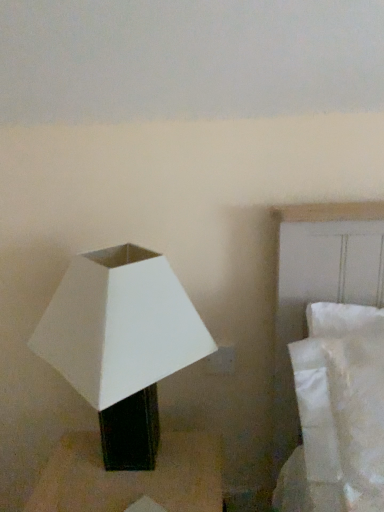
Locate an element on the screen. white matte lampshade at left is located at coordinates (121, 344).

This screenshot has width=384, height=512. What do you see at coordinates (121, 344) in the screenshot?
I see `white matte lampshade at left` at bounding box center [121, 344].

Image resolution: width=384 pixels, height=512 pixels. I want to click on white matte lampshade at left, so click(121, 344).